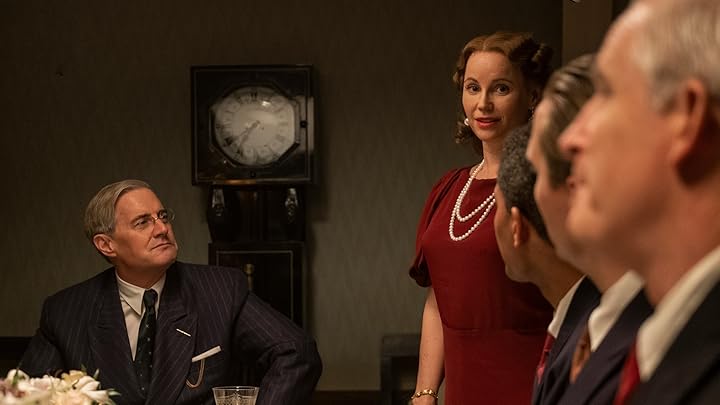
This screenshot has width=720, height=405. Find the location of `glass`. glass is located at coordinates (229, 395).